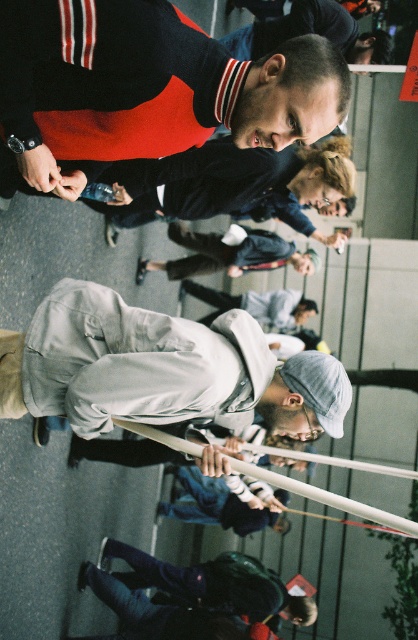
Question: Is matte black sweater at upper center positioned in front of light gray cotton jacket at center?

Choices:
 (A) no
 (B) yes

Answer: (B)

Question: Which object is the farthest from the light gray fabric jacket at center?

Choices:
 (A) matte black sweater at upper center
 (B) light gray cotton jacket at center
 (C) dark blue sweater at upper center

Answer: (B)

Question: Among these points, which one is nearest to the camera?

Choices:
 (A) (30, 161)
 (B) (120, 188)

Answer: (A)

Question: Does dark blue sweater at upper center lie behind light gray cotton jacket at center?

Choices:
 (A) yes
 (B) no

Answer: (B)

Question: Which object is farther from the camera taking this photo?

Choices:
 (A) dark blue sweater at upper center
 (B) matte black sweater at upper center

Answer: (A)

Question: Is matte black sweater at upper center to the right of light gray cotton jacket at center from the viewer's perspective?

Choices:
 (A) yes
 (B) no

Answer: (B)